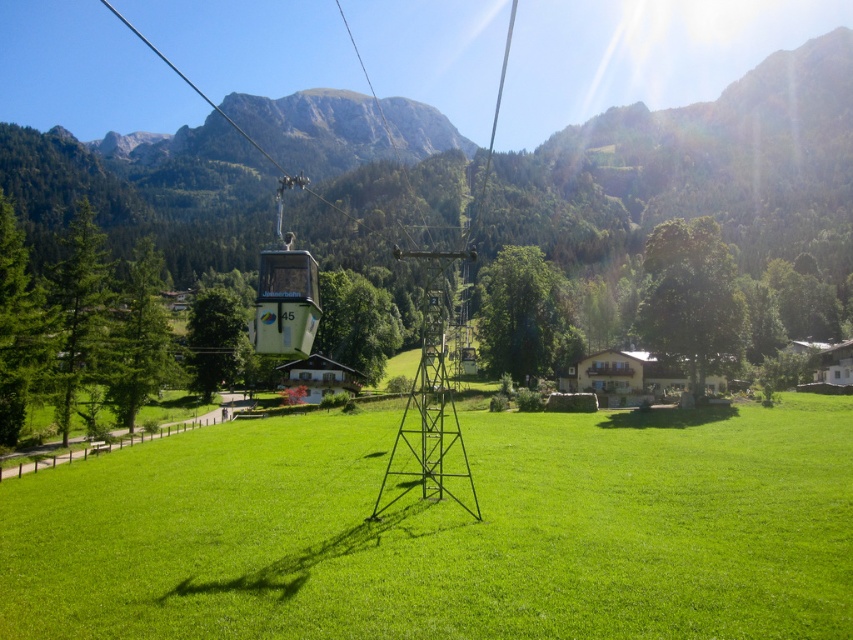
Question: Does green grass at center have a greater width compared to green matte cable car at center?

Choices:
 (A) no
 (B) yes

Answer: (A)

Question: Among these points, which one is nearest to the camera?

Choices:
 (A) (302, 304)
 (B) (753, 552)

Answer: (A)

Question: Which point is farther to the camera?

Choices:
 (A) green grass at center
 (B) green matte cable car at center

Answer: (B)

Question: Which point is farther from the camera taking this photo?

Choices:
 (A) (285, 182)
 (B) (212, 467)

Answer: (B)

Question: Does green grass at center have a larger size compared to green matte cable car at center?

Choices:
 (A) no
 (B) yes

Answer: (A)

Question: Is green grass at center to the right of green matte cable car at center from the viewer's perspective?

Choices:
 (A) yes
 (B) no

Answer: (A)